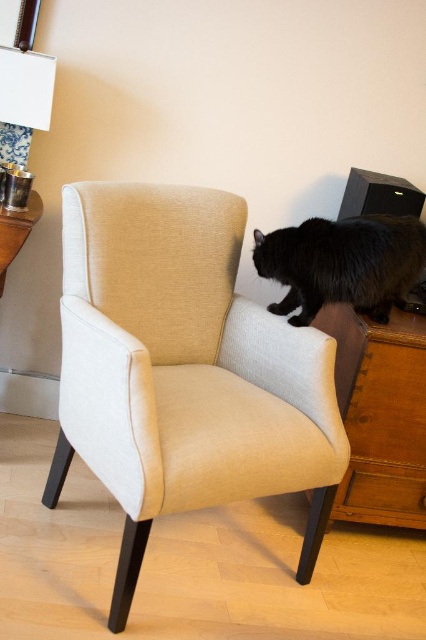
Question: Based on their relative distances, which object is nearer to the beige fabric swivel chair at center?

Choices:
 (A) black fluffy cat on the right
 (B) brown wooden dresser at lower right

Answer: (A)

Question: Which of these objects is positioned closest to the brown wooden dresser at lower right?

Choices:
 (A) black fluffy cat on the right
 (B) beige fabric swivel chair at center

Answer: (A)

Question: Can you confirm if beige fabric swivel chair at center is positioned below brown wooden dresser at lower right?

Choices:
 (A) no
 (B) yes

Answer: (A)

Question: Does brown wooden dresser at lower right appear under black fluffy cat on the right?

Choices:
 (A) yes
 (B) no

Answer: (A)

Question: Which object is positioned closest to the brown wooden dresser at lower right?

Choices:
 (A) black fluffy cat on the right
 (B) beige fabric swivel chair at center

Answer: (A)

Question: Is brown wooden dresser at lower right above black fluffy cat on the right?

Choices:
 (A) no
 (B) yes

Answer: (A)